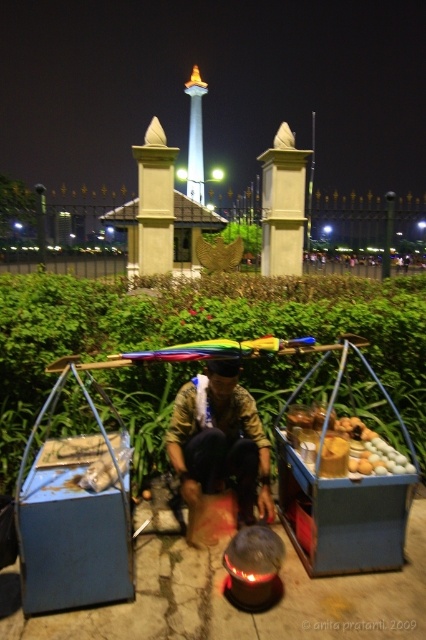
You are a customer at the nighttime food stall. You see the smooth wooden tray at center. Where exactly is it positioned relative to the vendor?

The smooth wooden tray at center is located at point coordinates of 0.702 on the x axis and 0.864 on the y axis.

Based on the photo, you are a customer at the vendor stall. You want to place your phone on the largest available flat surface. Which object should you choose between the camouflage fabric at center and the smooth wooden tray at center?

The camouflage fabric at center has a larger size compared to the smooth wooden tray at center, so you should place your phone on the camouflage fabric at center.